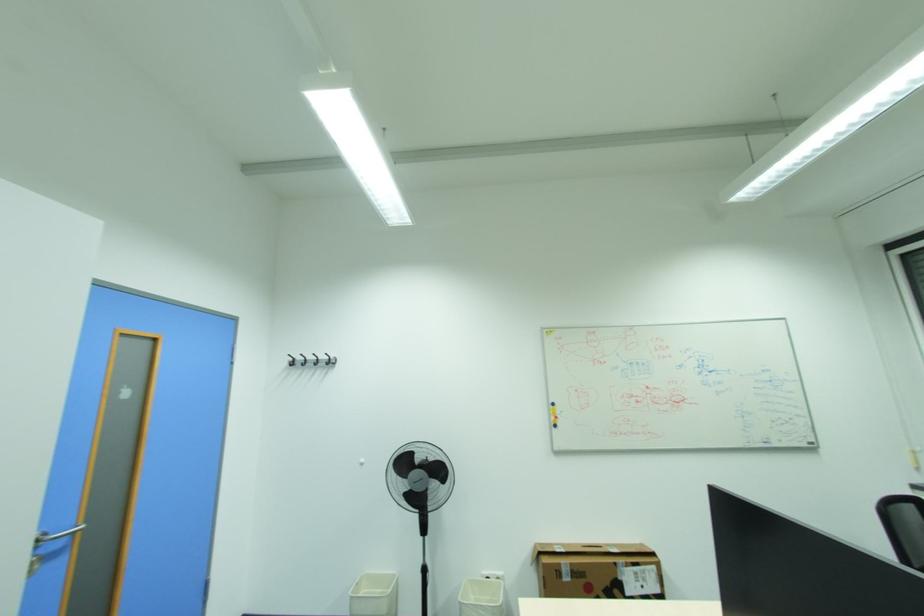
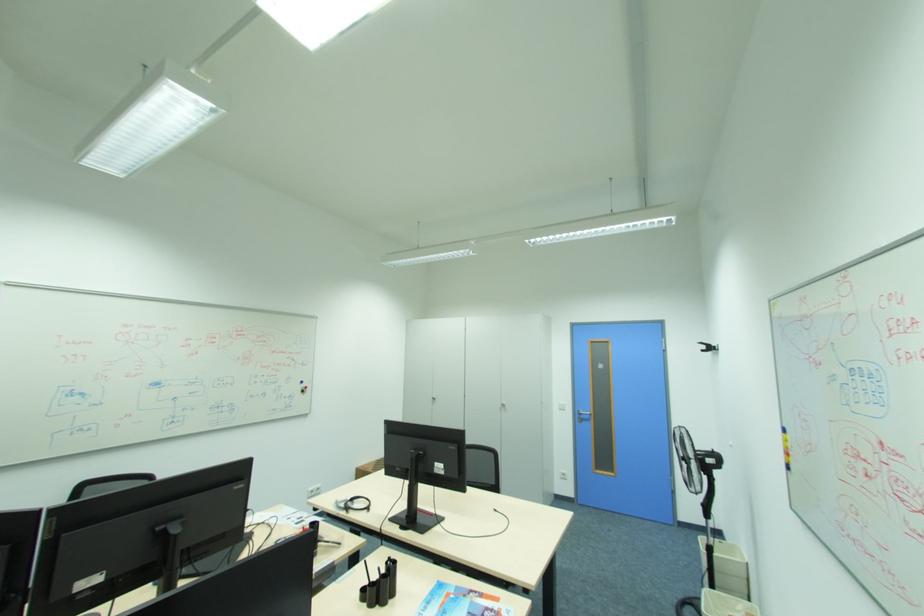
Where in the second image is the point corresponding to point 564,413 from the first image?

(794, 446)